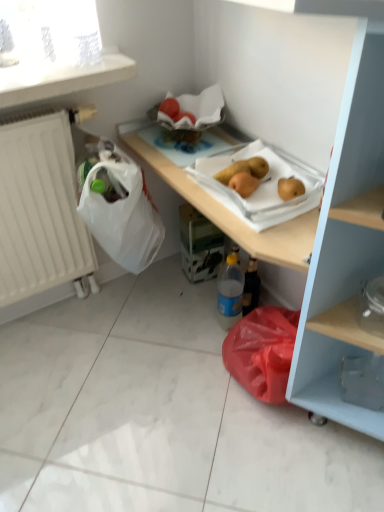
The width and height of the screenshot is (384, 512). I want to click on vacant space underneath white matte radiator at left (from a real-world perspective), so click(61, 305).